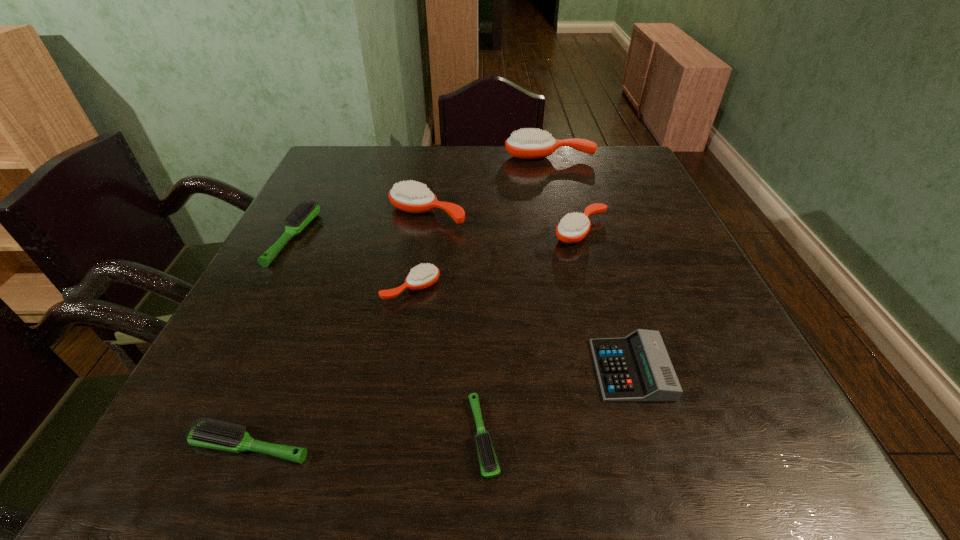
Where is `free location at the near left corner of the desktop`? This screenshot has width=960, height=540. free location at the near left corner of the desktop is located at coordinates (259, 463).

The image size is (960, 540). In order to click on vacant space at the far right corner of the desktop in this screenshot , I will do pos(623,154).

Identify the location of free region at the near right corner of the desktop. The image size is (960, 540). (752, 480).

You are a GUI agent. You are given a task and a screenshot of the screen. Output one action in this format:
    pyautogui.click(x=<x>, y=<y>)
    Task: Click on the unoccupied position between the second biggest light hairbrush and the tallest hairbrush
    The width and height of the screenshot is (960, 540).
    Given the screenshot: What is the action you would take?
    pyautogui.click(x=400, y=301)

Where is `free space between the smallest orange hairbrush and the shortest hairbrush`? The height and width of the screenshot is (540, 960). free space between the smallest orange hairbrush and the shortest hairbrush is located at coordinates (447, 362).

The width and height of the screenshot is (960, 540). Identify the location of vacant space that's between the calculator and the farthest light hairbrush. (463, 303).

Find the location of `free space that is in between the second tallest object and the third hairbrush from right to left`. free space that is in between the second tallest object and the third hairbrush from right to left is located at coordinates (455, 325).

I want to click on vacant point located between the farthest light hairbrush and the sixth tallest hairbrush, so click(273, 341).

Locate an element on the screen. The width and height of the screenshot is (960, 540). vacant area that lies between the fifth shortest hairbrush and the biggest light hairbrush is located at coordinates (438, 234).

This screenshot has width=960, height=540. In order to click on blank region between the third biggest orange hairbrush and the farthest object in this screenshot , I will do `click(565, 193)`.